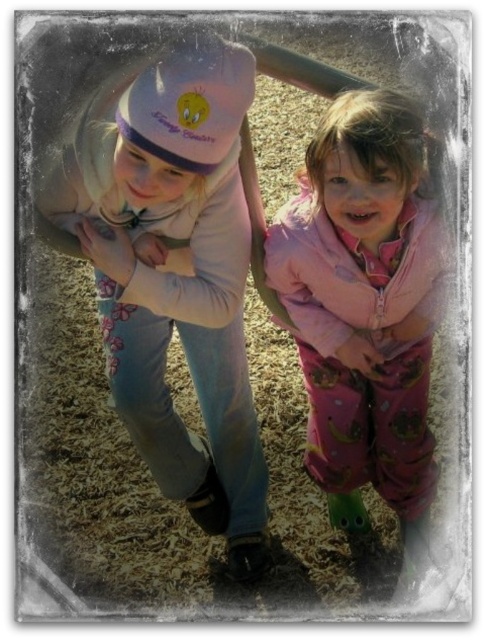
Question: Is pink fleece sweater at upper center wider than pink fleece jacket at center?

Choices:
 (A) yes
 (B) no

Answer: (A)

Question: Considering the relative positions of pink fleece sweater at upper center and pink fleece jacket at center in the image provided, where is pink fleece sweater at upper center located with respect to pink fleece jacket at center?

Choices:
 (A) left
 (B) right

Answer: (A)

Question: Can you confirm if pink fleece sweater at upper center is positioned above pink fleece jacket at center?

Choices:
 (A) yes
 (B) no

Answer: (A)

Question: Which point is farther to the camera?

Choices:
 (A) pink fleece sweater at upper center
 (B) pink fleece jacket at center

Answer: (B)

Question: Which point is closer to the camera?

Choices:
 (A) pink fleece sweater at upper center
 (B) pink fleece jacket at center

Answer: (A)

Question: Among these objects, which one is nearest to the camera?

Choices:
 (A) pink fleece jacket at center
 (B) pink fleece sweater at upper center

Answer: (B)